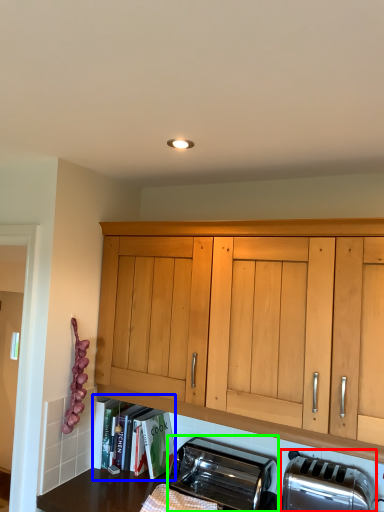
Question: Which is nearer to the toaster (highlighted by a red box)? shelf (highlighted by a blue box) or toaster (highlighted by a green box).

Choices:
 (A) shelf
 (B) toaster

Answer: (B)